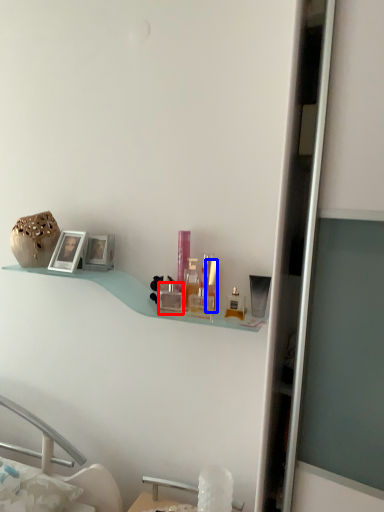
Question: Which point is further to the camera, toiletry (highlighted by a red box) or toiletry (highlighted by a blue box)?

Choices:
 (A) toiletry
 (B) toiletry

Answer: (A)